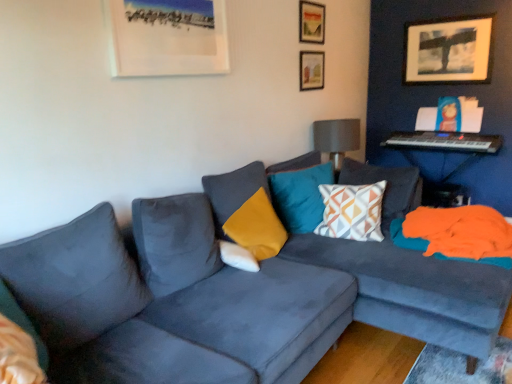
What do you see at coordinates (246, 210) in the screenshot? I see `yellow velvet pillow at center, acting as the 3th pillow starting from the right` at bounding box center [246, 210].

Measure the distance between point (311, 231) and camera.

The depth of point (311, 231) is 8.98 feet.

Measure the distance between geometric-patterned fabric pillow at center, marked as the fourth pillow in a left-to-right arrangement, and camera.

geometric-patterned fabric pillow at center, marked as the fourth pillow in a left-to-right arrangement, is 2.54 meters from camera.

Describe the element at coordinates (167, 37) in the screenshot. Image resolution: width=512 pixels, height=384 pixels. I see `matte white picture frame at upper left, the 4th picture frame when ordered from back to front` at that location.

What do you see at coordinates (311, 70) in the screenshot? The height and width of the screenshot is (384, 512). I see `wooden picture frame at upper center, the second picture frame when ordered from back to front` at bounding box center [311, 70].

This screenshot has width=512, height=384. Describe the element at coordinates (311, 22) in the screenshot. I see `wooden picture frame at upper center, the 2th picture frame from the left` at that location.

Find the location of a particular element. This screenshot has height=384, width=512. matte gray lampshade at upper right is located at coordinates (336, 138).

At what (x,y) coordinates should I click in order to perform the action: click on yellow velvet pillow at center, acting as the 3th pillow starting from the right. Please return your answer as a coordinate pair (x, y). Looking at the image, I should click on (246, 210).

Which of these two, yellow velvet pillow at center, which is the 2th pillow from left to right, or wooden picture frame at upper center, the third picture frame viewed from the front, is smaller?

Smaller between the two is wooden picture frame at upper center, the third picture frame viewed from the front.

Which object is further away from the camera taking this photo, yellow velvet pillow at center, acting as the 3th pillow starting from the right, or wooden picture frame at upper center, which is counted as the third picture frame, starting from the left?

wooden picture frame at upper center, which is counted as the third picture frame, starting from the left, is more distant.

From the yellow velvet pillow at center, acting as the 3th pillow starting from the right, count 2nd picture frames backward and point to it. Please provide its 2D coordinates.

[(311, 70)]

Is yellow velvet pillow at center, acting as the 3th pillow starting from the right, situated inside wooden picture frame at upper center, marked as the second picture frame in a right-to-left arrangement, or outside?

The correct answer is: outside.

From the image's perspective, between metallic silver keyboard at upper right and matte gray lampshade at upper right, who is located below?

matte gray lampshade at upper right appears lower in the image.

Can you confirm if metallic silver keyboard at upper right is shorter than matte gray lampshade at upper right?

Correct, metallic silver keyboard at upper right is not as tall as matte gray lampshade at upper right.

Does metallic silver keyboard at upper right appear on the right side of matte gray lampshade at upper right?

Yes, metallic silver keyboard at upper right is to the right of matte gray lampshade at upper right.

From a real-world perspective, is wooden picture frame at upper center, the 2th picture frame in the front-to-back sequence, beneath matte white picture frame at upper left, the fourth picture frame from the right?

No, from a real-world perspective, wooden picture frame at upper center, the 2th picture frame in the front-to-back sequence, is not under matte white picture frame at upper left, the fourth picture frame from the right.

Based on the photo, can you confirm if wooden picture frame at upper center, the 2th picture frame from the left, is wider than matte white picture frame at upper left, the 4th picture frame when ordered from back to front?

No, wooden picture frame at upper center, the 2th picture frame from the left, is not wider than matte white picture frame at upper left, the 4th picture frame when ordered from back to front.

Considering the sizes of objects wooden picture frame at upper center, the 2th picture frame from the left, and matte white picture frame at upper left, the fourth picture frame from the right, in the image provided, who is smaller, wooden picture frame at upper center, the 2th picture frame from the left, or matte white picture frame at upper left, the fourth picture frame from the right,?

Smaller between the two is wooden picture frame at upper center, the 2th picture frame from the left.

Considering the positions of objects wooden picture frame at upper center, the third picture frame viewed from the right, and matte white picture frame at upper left, the fourth picture frame from the right, in the image provided, who is more to the left, wooden picture frame at upper center, the third picture frame viewed from the right, or matte white picture frame at upper left, the fourth picture frame from the right,?

From the viewer's perspective, matte white picture frame at upper left, the fourth picture frame from the right, appears more on the left side.

From a real-world perspective, is wooden picture frame at upper right, which appears as the 4th picture frame when viewed from the front, beneath matte white picture frame at upper left, the 4th picture frame when ordered from back to front?

Yes.

I want to click on the 1st picture frame directly beneath the matte white picture frame at upper left, the fourth picture frame from the right (from a real-world perspective), so click(448, 50).

Is wooden picture frame at upper right, which is the 1th picture frame in right-to-left order, taller than matte white picture frame at upper left, the 4th picture frame when ordered from back to front?

Yes.

From the image's perspective, which is above, wooden picture frame at upper right, which ranks as the 4th picture frame in left-to-right order, or matte white picture frame at upper left, the first picture frame in the front-to-back sequence?

wooden picture frame at upper right, which ranks as the 4th picture frame in left-to-right order, from the image's perspective.

Consider the image. Is wooden picture frame at upper center, the second picture frame when ordered from back to front, not inside white soft pillow at center, which is the 4th pillow in right-to-left order?

That's correct, wooden picture frame at upper center, the second picture frame when ordered from back to front, is outside of white soft pillow at center, which is the 4th pillow in right-to-left order.

Between wooden picture frame at upper center, the second picture frame when ordered from back to front, and white soft pillow at center, which is the 4th pillow in right-to-left order, which one is positioned behind?

Positioned behind is wooden picture frame at upper center, the second picture frame when ordered from back to front.

Does wooden picture frame at upper center, the second picture frame when ordered from back to front, have a greater height compared to white soft pillow at center, which is the 4th pillow in right-to-left order?

Yes.

From a real-world perspective, is wooden picture frame at upper center, marked as the second picture frame in a right-to-left arrangement, above or below teal velvet pillow at center, the 2th pillow in the right-to-left sequence?

In terms of real-world spatial position, wooden picture frame at upper center, marked as the second picture frame in a right-to-left arrangement, is above teal velvet pillow at center, the 2th pillow in the right-to-left sequence.

Which is more distant, (312, 67) or (286, 172)?

The point (312, 67) is farther.

There is a wooden picture frame at upper center, the third picture frame viewed from the front. Find the location of `the 1st pillow below it (from the image's perspective)`. the 1st pillow below it (from the image's perspective) is located at coordinates (300, 196).

The image size is (512, 384). Find the location of `piano behind the white soft pillow at center, the first pillow positioned from the left`. piano behind the white soft pillow at center, the first pillow positioned from the left is located at coordinates (445, 141).

From the image's perspective, is metallic silver keyboard at upper right over white soft pillow at center, which is the 4th pillow in right-to-left order?

Yes, from the image's perspective, metallic silver keyboard at upper right is above white soft pillow at center, which is the 4th pillow in right-to-left order.

Is metallic silver keyboard at upper right wider than white soft pillow at center, the first pillow positioned from the left?

Yes, metallic silver keyboard at upper right is wider than white soft pillow at center, the first pillow positioned from the left.

Based on the photo, is metallic silver keyboard at upper right not near white soft pillow at center, the first pillow positioned from the left?

Indeed, metallic silver keyboard at upper right is not near white soft pillow at center, the first pillow positioned from the left.

The height and width of the screenshot is (384, 512). I want to click on picture frame that is the 2nd object located above the yellow velvet pillow at center, which is the 2th pillow from left to right (from the image's perspective), so (311, 70).

Find the location of a particular element. lamp above the metallic silver keyboard at upper right (from a real-world perspective) is located at coordinates [x=336, y=138].

In the scene shown: Which object lies nearer to the anchor point white soft pillow at center, the first pillow positioned from the left, matte gray lampshade at upper right or geometric-patterned fabric pillow at center, marked as the fourth pillow in a left-to-right arrangement?

geometric-patterned fabric pillow at center, marked as the fourth pillow in a left-to-right arrangement.

Which object lies further to the anchor point yellow velvet pillow at center, which is the 2th pillow from left to right, matte white picture frame at upper left, the first picture frame in the front-to-back sequence, or white soft pillow at center, the first pillow positioned from the left?

matte white picture frame at upper left, the first picture frame in the front-to-back sequence, lies further to yellow velvet pillow at center, which is the 2th pillow from left to right, than the other object.

Based on their spatial positions, is wooden picture frame at upper center, the 2th picture frame from the left, or yellow velvet pillow at center, acting as the 3th pillow starting from the right, closer to wooden picture frame at upper center, marked as the second picture frame in a right-to-left arrangement?

wooden picture frame at upper center, the 2th picture frame from the left, is closer to wooden picture frame at upper center, marked as the second picture frame in a right-to-left arrangement.

Based on their spatial positions, is matte white picture frame at upper left, the fourth picture frame from the right, or yellow velvet pillow at center, which is the 2th pillow from left to right, further from wooden picture frame at upper center, which is counted as the third picture frame, starting from the left?

yellow velvet pillow at center, which is the 2th pillow from left to right, is positioned further to the anchor wooden picture frame at upper center, which is counted as the third picture frame, starting from the left.

Considering their positions, is yellow velvet pillow at center, acting as the 3th pillow starting from the right, positioned closer to matte white picture frame at upper left, the first picture frame in the front-to-back sequence, than wooden picture frame at upper right, the first picture frame when ordered from back to front?

yellow velvet pillow at center, acting as the 3th pillow starting from the right, lies closer to matte white picture frame at upper left, the first picture frame in the front-to-back sequence, than the other object.

From the image, which object appears to be nearer to teal velvet pillow at center, which is the 3th pillow from left to right, matte gray lampshade at upper right or matte white picture frame at upper left, the first picture frame in the front-to-back sequence?

matte gray lampshade at upper right is positioned closer to the anchor teal velvet pillow at center, which is the 3th pillow from left to right.

When comparing their distances from geometric-patterned fabric pillow at center, marked as the fourth pillow in a left-to-right arrangement, does white soft pillow at center, which is the 4th pillow in right-to-left order, or matte gray lampshade at upper right seem further?

white soft pillow at center, which is the 4th pillow in right-to-left order.

Looking at the image, which one is located closer to wooden picture frame at upper center, which ranks as the 3th picture frame in back-to-front order, wooden picture frame at upper right, the first picture frame when ordered from back to front, or white soft pillow at center, which is the 4th pillow in right-to-left order?

wooden picture frame at upper right, the first picture frame when ordered from back to front, is positioned closer to the anchor wooden picture frame at upper center, which ranks as the 3th picture frame in back-to-front order.

Find the location of a particular element. lamp between wooden picture frame at upper center, the third picture frame viewed from the right, and wooden picture frame at upper right, the first picture frame when ordered from back to front, in the horizontal direction is located at coordinates (336, 138).

The image size is (512, 384). In order to click on lamp between wooden picture frame at upper center, the second picture frame when ordered from back to front, and white soft pillow at center, which is the 4th pillow in right-to-left order, in the vertical direction in this screenshot , I will do [x=336, y=138].

The image size is (512, 384). What are the coordinates of `pillow between wooden picture frame at upper center, the third picture frame viewed from the right, and geometric-patterned fabric pillow at center, marked as the fourth pillow in a left-to-right arrangement, vertically` in the screenshot? It's located at (300, 196).

Locate an element on the screen. This screenshot has height=384, width=512. picture frame situated between wooden picture frame at upper center, the third picture frame viewed from the right, and metallic silver keyboard at upper right from left to right is located at coordinates (311, 70).